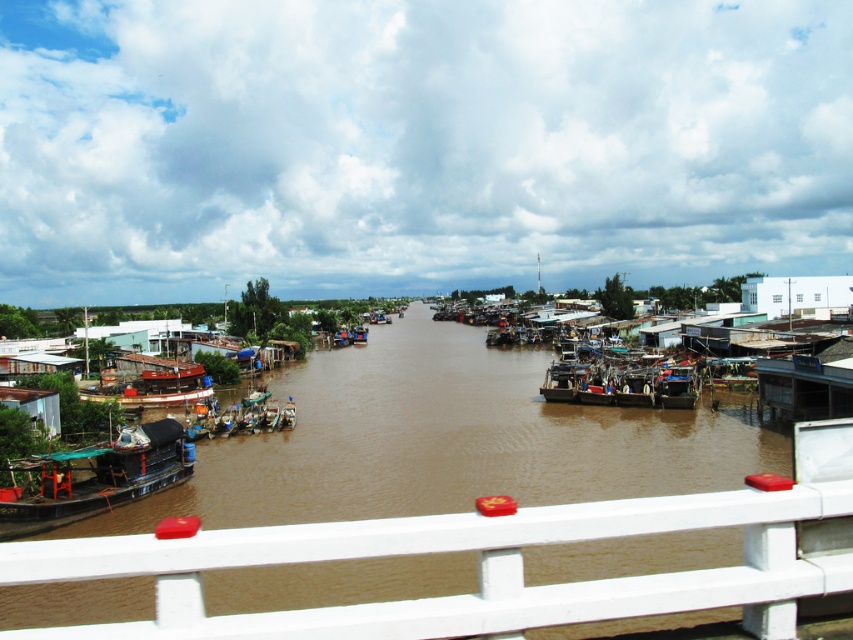
Between brown matte river at center and green matte boat at lower left, which one is positioned lower?

green matte boat at lower left is lower down.

I want to click on brown matte river at center, so click(444, 440).

Between point (646, 410) and point (12, 509), which one is positioned behind?

The point (646, 410) is behind.

This screenshot has height=640, width=853. I want to click on brown matte river at center, so click(x=444, y=440).

Describe the element at coordinates (477, 570) in the screenshot. The image size is (853, 640). I see `white painted metal rail at lower center` at that location.

Which is in front, point (62, 560) or point (154, 456)?

Point (62, 560)

Where is `white painted metal rail at lower center`? The width and height of the screenshot is (853, 640). white painted metal rail at lower center is located at coordinates (477, 570).

Can you confirm if brown matte river at center is positioned to the right of wooden boat at center?

Incorrect, brown matte river at center is not on the right side of wooden boat at center.

Does brown matte river at center have a lesser height compared to wooden boat at center?

No.

Between point (433, 429) and point (692, 396), which one is positioned behind?

The point (692, 396) is more distant.

Locate an element on the screen. This screenshot has height=640, width=853. brown matte river at center is located at coordinates (444, 440).